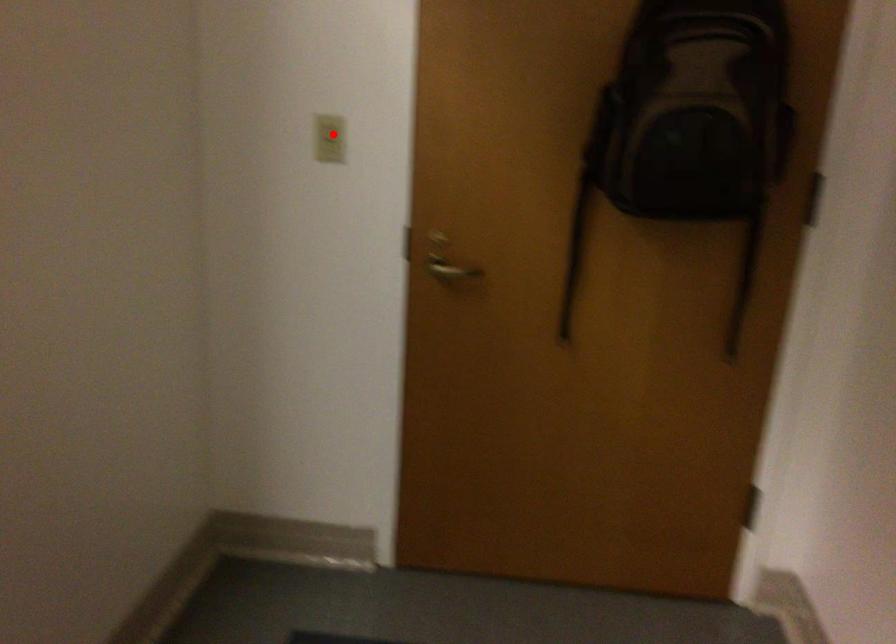
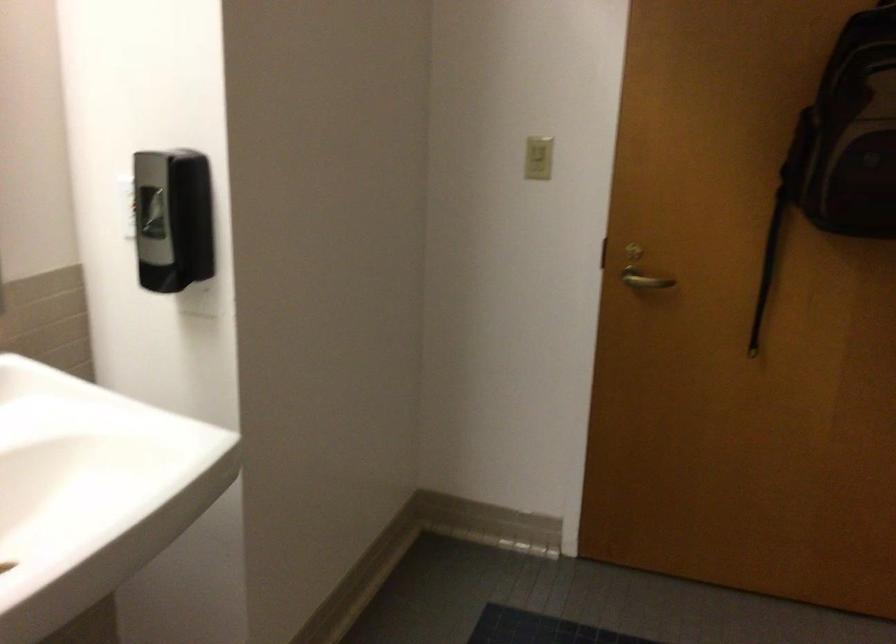
Where in the second image is the point corresponding to the highlighted location from the first image?

(538, 158)